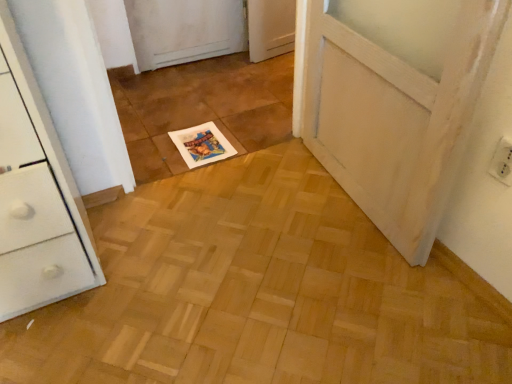
Question: Does white paper magazine at center lie in front of white plastic electric outlet at upper right?

Choices:
 (A) yes
 (B) no

Answer: (B)

Question: From the image's perspective, is white paper magazine at center located beneath white plastic electric outlet at upper right?

Choices:
 (A) no
 (B) yes

Answer: (A)

Question: Is white paper magazine at center oriented away from white plastic electric outlet at upper right?

Choices:
 (A) yes
 (B) no

Answer: (B)

Question: Is white plastic electric outlet at upper right inside white paper magazine at center?

Choices:
 (A) no
 (B) yes

Answer: (A)

Question: Is white paper magazine at center not within white plastic electric outlet at upper right?

Choices:
 (A) yes
 (B) no

Answer: (A)

Question: Can you confirm if white paper magazine at center is shorter than white plastic electric outlet at upper right?

Choices:
 (A) yes
 (B) no

Answer: (A)

Question: Is white plastic electric outlet at upper right far away from white paper magazine at center?

Choices:
 (A) no
 (B) yes

Answer: (B)

Question: Does white plastic electric outlet at upper right lie in front of white paper magazine at center?

Choices:
 (A) yes
 (B) no

Answer: (A)

Question: Is white plastic electric outlet at upper right behind white paper magazine at center?

Choices:
 (A) no
 (B) yes

Answer: (A)

Question: From a real-world perspective, is white plastic electric outlet at upper right over white paper magazine at center?

Choices:
 (A) no
 (B) yes

Answer: (B)

Question: Does white plastic electric outlet at upper right have a larger size compared to white paper magazine at center?

Choices:
 (A) no
 (B) yes

Answer: (A)

Question: Can you confirm if white plastic electric outlet at upper right is taller than white paper magazine at center?

Choices:
 (A) yes
 (B) no

Answer: (A)

Question: Considering the positions of white paper magazine at center and white plastic electric outlet at upper right in the image, is white paper magazine at center taller or shorter than white plastic electric outlet at upper right?

Choices:
 (A) tall
 (B) short

Answer: (B)